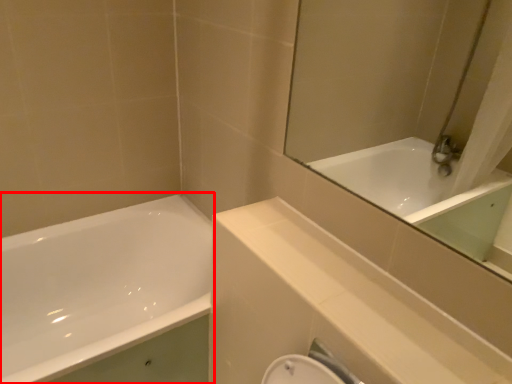
Question: From the image's perspective, where is bathtub (annotated by the red box) located relative to balustrade?

Choices:
 (A) above
 (B) below

Answer: (B)